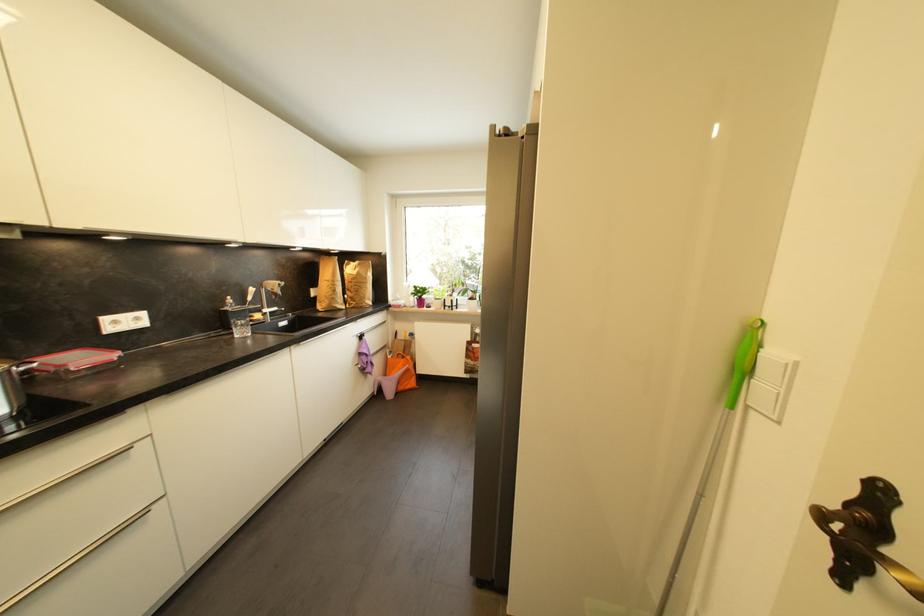
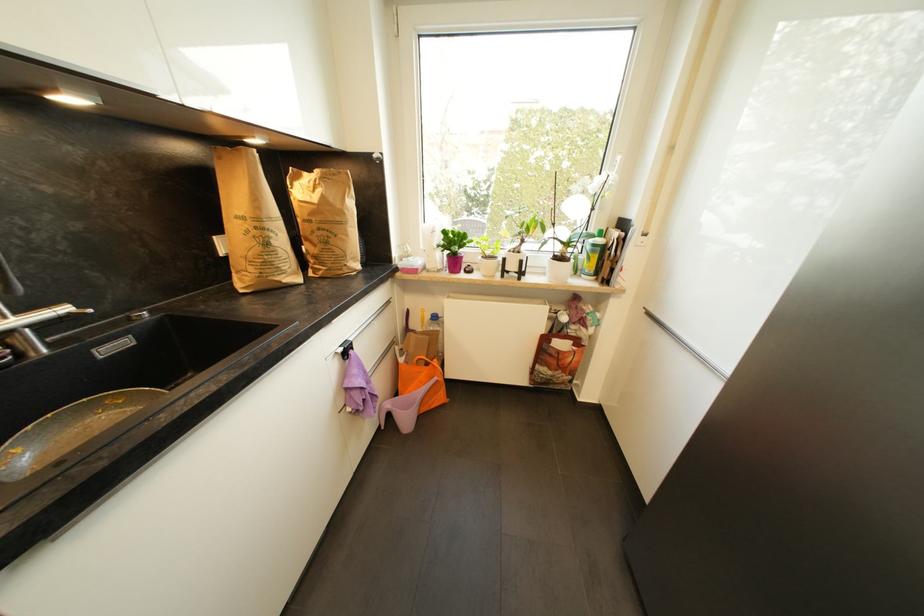
The point at (418, 385) is marked in the first image. Where is the corresponding point in the second image?

(445, 399)